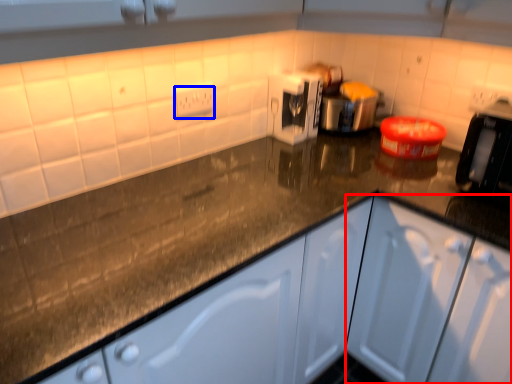
Question: Which object is closer to the camera taking this photo, cabinetry (highlighted by a red box) or electric outlet (highlighted by a blue box)?

Choices:
 (A) cabinetry
 (B) electric outlet

Answer: (A)